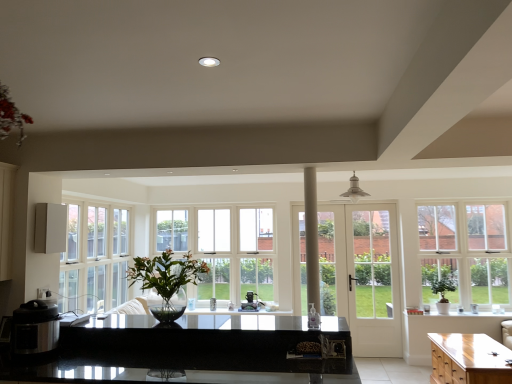
I want to click on black matte electric pressure cooker at left, which ranks as the 3th appliance in back-to-front order, so click(35, 328).

What do you see at coordinates (167, 280) in the screenshot? I see `translucent glass vase at center, the 2th houseplant from the back` at bounding box center [167, 280].

Looking at this image, measure the distance between white glass door at center and camera.

white glass door at center is 4.23 meters away from camera.

How much space does satin black coffee maker at center, which is the 1th appliance from bottom to top, occupy vertically?

satin black coffee maker at center, which is the 1th appliance from bottom to top, is 8.76 inches in height.

The height and width of the screenshot is (384, 512). Describe the element at coordinates (443, 293) in the screenshot. I see `green leafy plant at right, placed as the second houseplant when sorted from front to back` at that location.

Identify the location of black matte electric pressure cooker at left, which ranks as the 3th appliance in back-to-front order. (35, 328).

From the picture: Can you tell me how much translucent glass vase at center, which appears as the 2th houseplant when viewed from the right, and white wood window at center, which is the 1th window in left-to-right order, differ in facing direction?

translucent glass vase at center, which appears as the 2th houseplant when viewed from the right, and white wood window at center, which is the 1th window in left-to-right order, are facing 3.21 degrees away from each other.

Is translucent glass vase at center, which is the 1th houseplant in top-to-bottom order, situated inside white wood window at center, placed as the second window when sorted from front to back, or outside?

translucent glass vase at center, which is the 1th houseplant in top-to-bottom order, lies outside white wood window at center, placed as the second window when sorted from front to back.

Is translucent glass vase at center, which appears as the 2th houseplant when viewed from the right, oriented away from white wood window at center, placed as the second window when sorted from front to back?

Yes.

In the scene shown: Considering the sizes of objects translucent glass vase at center, marked as the 2th houseplant in a bottom-to-top arrangement, and white wood window at center, placed as the 2th window when sorted from right to left, in the image provided, who is wider, translucent glass vase at center, marked as the 2th houseplant in a bottom-to-top arrangement, or white wood window at center, placed as the 2th window when sorted from right to left,?

With larger width is translucent glass vase at center, marked as the 2th houseplant in a bottom-to-top arrangement.

Looking at this image, is satin black coffee maker at center, which is the 3th appliance from top to bottom, further to the viewer compared to black matte electric pressure cooker at left, positioned as the 1th appliance in front-to-back order?

Yes, it is.

Is point (254, 302) behind point (48, 346)?

That is True.

Which of these two, satin black coffee maker at center, the 3th appliance from the front, or black matte electric pressure cooker at left, which ranks as the 3th appliance in back-to-front order, is smaller?

Smaller between the two is satin black coffee maker at center, the 3th appliance from the front.

Based on the photo, is the surface of satin black coffee maker at center, which ranks as the 1th appliance in back-to-front order, in direct contact with black matte electric pressure cooker at left, positioned as the 1th appliance in front-to-back order?

No, satin black coffee maker at center, which ranks as the 1th appliance in back-to-front order, is not with black matte electric pressure cooker at left, positioned as the 1th appliance in front-to-back order.

From a real-world perspective, who is located higher, white wood window at center, placed as the second window when sorted from front to back, or satin black coffee maker at center, which is the 1th appliance from bottom to top?

white wood window at center, placed as the second window when sorted from front to back, is physically above.

Is white wood window at center, placed as the 2th window when sorted from right to left, situated inside satin black coffee maker at center, which is the 3th appliance from top to bottom, or outside?

white wood window at center, placed as the 2th window when sorted from right to left, cannot be found inside satin black coffee maker at center, which is the 3th appliance from top to bottom.

Consider the image. From the image's perspective, which is below, white wood window at center, placed as the 2th window when sorted from right to left, or satin black coffee maker at center, which is the 1th appliance from bottom to top?

satin black coffee maker at center, which is the 1th appliance from bottom to top, appears lower in the image.

Starting from the white wood window at center, which is the 1th window in left-to-right order, which appliance is the 1st one in front? Please provide its 2D coordinates.

[(250, 302)]

In order to click on appliance that is the 1st one when counting upward from the white wood window at center, placed as the 2th window when sorted from right to left (from the image's perspective) in this screenshot , I will do `click(35, 328)`.

Does black matte electric pressure cooker at left, placed as the 2th appliance when sorted from bottom to top, have a lesser width compared to white wood window at center, placed as the 2th window when sorted from right to left?

In fact, black matte electric pressure cooker at left, placed as the 2th appliance when sorted from bottom to top, might be wider than white wood window at center, placed as the 2th window when sorted from right to left.

Which is more distant, (11, 349) or (195, 232)?

The point (195, 232) is farther from the camera.

Considering the relative positions of black matte electric pressure cooker at left, placed as the 2th appliance when sorted from bottom to top, and white wood window at center, placed as the 2th window when sorted from right to left, in the image provided, is black matte electric pressure cooker at left, placed as the 2th appliance when sorted from bottom to top, behind white wood window at center, placed as the 2th window when sorted from right to left,?

That is False.

Is satin black coffee maker at center, which is counted as the third appliance, starting from the left, looking in the opposite direction of white glossy speaker at left, which is the 2th appliance from back to front?

No, satin black coffee maker at center, which is counted as the third appliance, starting from the left, is not facing away from white glossy speaker at left, which is the 2th appliance from back to front.

Looking at this image, who is shorter, satin black coffee maker at center, which ranks as the 1th appliance in back-to-front order, or white glossy speaker at left, positioned as the first appliance in left-to-right order?

With less height is satin black coffee maker at center, which ranks as the 1th appliance in back-to-front order.

Can you confirm if satin black coffee maker at center, the 3th appliance from the front, is wider than white glossy speaker at left, which is the 1th appliance in top-to-bottom order?

Yes, satin black coffee maker at center, the 3th appliance from the front, is wider than white glossy speaker at left, which is the 1th appliance in top-to-bottom order.

Is satin black coffee maker at center, which is the 1th appliance in right-to-left order, spatially inside white glossy speaker at left, positioned as the first appliance in left-to-right order, or outside of it?

satin black coffee maker at center, which is the 1th appliance in right-to-left order, is outside white glossy speaker at left, positioned as the first appliance in left-to-right order.

The width and height of the screenshot is (512, 384). I want to click on the 1st window behind the white glossy speaker at left, acting as the 2th appliance starting from the front, counting from the anchor's position, so click(466, 253).

Considering the points (485, 226) and (65, 243), which point is in front, point (485, 226) or point (65, 243)?

The point (65, 243) is closer.

Which of these two, white glass window at right, marked as the first window in a right-to-left arrangement, or white glossy speaker at left, which is the 1th appliance in top-to-bottom order, is smaller?

Smaller between the two is white glossy speaker at left, which is the 1th appliance in top-to-bottom order.

Does white glass window at right, marked as the first window in a right-to-left arrangement, have a greater height compared to white glossy speaker at left, which is the 1th appliance in top-to-bottom order?

Yes.

Is point (442, 277) farther from camera compared to point (251, 297)?

That is False.

Could you tell me if green leafy plant at right, marked as the second houseplant in a top-to-bottom arrangement, is turned towards satin black coffee maker at center, which is the 1th appliance in right-to-left order?

No, green leafy plant at right, marked as the second houseplant in a top-to-bottom arrangement, is not turned towards satin black coffee maker at center, which is the 1th appliance in right-to-left order.

Relative to satin black coffee maker at center, which is the 1th appliance from bottom to top, is green leafy plant at right, marked as the second houseplant in a top-to-bottom arrangement, in front or behind?

green leafy plant at right, marked as the second houseplant in a top-to-bottom arrangement, is in front of satin black coffee maker at center, which is the 1th appliance from bottom to top.

I want to click on appliance that appears below the green leafy plant at right, the second houseplant viewed from the left (from the image's perspective), so click(x=250, y=302).

This screenshot has width=512, height=384. In order to click on the 1st houseplant below the white wood window at center, which is the 1th window in left-to-right order (from a real-world perspective) in this screenshot , I will do `click(167, 280)`.

Image resolution: width=512 pixels, height=384 pixels. Identify the location of appliance that is on the right side of black matte electric pressure cooker at left, which is counted as the 2th appliance, starting from the left. (250, 302).

Estimate the real-world distances between objects in this image. Which object is closer to black matte electric pressure cooker at left, the second appliance positioned from the right, white wood window at center, placed as the first window when sorted from back to front, or translucent glass vase at center, which appears as the 2th houseplant when viewed from the right?

The object closer to black matte electric pressure cooker at left, the second appliance positioned from the right, is translucent glass vase at center, which appears as the 2th houseplant when viewed from the right.

Estimate the real-world distances between objects in this image. Which object is closer to white glass door at center, translucent glass vase at center, the 1th houseplant in the front-to-back sequence, or white glossy speaker at left, acting as the 2th appliance starting from the front?

Based on the image, translucent glass vase at center, the 1th houseplant in the front-to-back sequence, appears to be nearer to white glass door at center.

When comparing their distances from black matte electric pressure cooker at left, the second appliance from the top, does white glass door at center or translucent glass vase at center, the 1th houseplant in the front-to-back sequence, seem further?

white glass door at center is positioned further to the anchor black matte electric pressure cooker at left, the second appliance from the top.

From the image, which object appears to be farther from black granite countertop at center, green leafy plant at right, placed as the second houseplant when sorted from front to back, or translucent glass vase at center, the 1th houseplant in the front-to-back sequence?

Based on the image, green leafy plant at right, placed as the second houseplant when sorted from front to back, appears to be further to black granite countertop at center.

Looking at the image, which one is located closer to white glossy speaker at left, the 3th appliance viewed from the right, satin black coffee maker at center, the 3th appliance from the front, or black matte electric pressure cooker at left, positioned as the 1th appliance in front-to-back order?

black matte electric pressure cooker at left, positioned as the 1th appliance in front-to-back order, is positioned closer to the anchor white glossy speaker at left, the 3th appliance viewed from the right.

Estimate the real-world distances between objects in this image. Which object is further from white wood window at center, placed as the 2th window when sorted from right to left, black granite countertop at center or white glass door at center?

Based on the image, black granite countertop at center appears to be further to white wood window at center, placed as the 2th window when sorted from right to left.

From the image, which object appears to be farther from white glossy speaker at left, acting as the 2th appliance starting from the front, translucent glass vase at center, which appears as the 1th houseplant when viewed from the left, or white glass window at right, which is counted as the 2th window, starting from the left?

The object further to white glossy speaker at left, acting as the 2th appliance starting from the front, is white glass window at right, which is counted as the 2th window, starting from the left.

Estimate the real-world distances between objects in this image. Which object is closer to white wood window at center, placed as the first window when sorted from back to front, translucent glass vase at center, which appears as the 1th houseplant when viewed from the left, or white glass door at center?

translucent glass vase at center, which appears as the 1th houseplant when viewed from the left, is closer to white wood window at center, placed as the first window when sorted from back to front.

You are a GUI agent. You are given a task and a screenshot of the screen. Output one action in this format:
    pyautogui.click(x=<x>, y=<y>)
    Task: Click on the window positioned between black granite countertop at center and white glass door at center from near to far
    The image size is (512, 384).
    Given the screenshot: What is the action you would take?
    pyautogui.click(x=466, y=253)

In order to click on countertop located between black matte electric pressure cooker at left, the second appliance from the top, and green leafy plant at right, marked as the second houseplant in a top-to-bottom arrangement, in the left-right direction in this screenshot , I will do `click(186, 352)`.

The image size is (512, 384). What are the coordinates of `houseplant positioned between light brown wooden cabinet at lower right and white glass door at center from near to far` in the screenshot? It's located at (443, 293).

Find the location of a particular element. appliance between translucent glass vase at center, which appears as the 1th houseplant when viewed from the left, and white glass window at right, which is the 1th window in front-to-back order, from left to right is located at coordinates (250, 302).